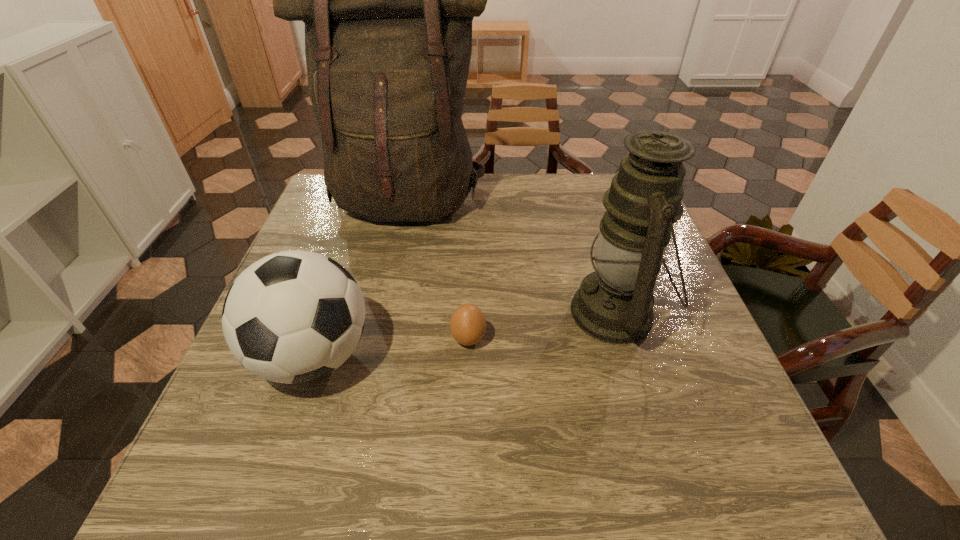
The height and width of the screenshot is (540, 960). What are the coordinates of `free space between the soccer ball and the tallest object` in the screenshot? It's located at (360, 279).

Locate an element on the screen. The height and width of the screenshot is (540, 960). vacant space that is in between the tallest object and the soccer ball is located at coordinates (x=360, y=279).

Where is `empty space that is in between the soccer ball and the backpack`? The image size is (960, 540). empty space that is in between the soccer ball and the backpack is located at coordinates (360, 279).

Locate an element on the screen. The width and height of the screenshot is (960, 540). empty location between the oil lamp and the backpack is located at coordinates (511, 258).

Where is `vacant space that is in between the soccer ball and the boiled egg`? The image size is (960, 540). vacant space that is in between the soccer ball and the boiled egg is located at coordinates (391, 348).

This screenshot has height=540, width=960. Identify the location of free point between the second tallest object and the farthest object. (511, 258).

You are a GUI agent. You are given a task and a screenshot of the screen. Output one action in this format:
    pyautogui.click(x=<x>, y=<y>)
    Task: Click on the free spot between the boiled egg and the soccer ball
    Image resolution: width=960 pixels, height=540 pixels.
    Given the screenshot: What is the action you would take?
    pyautogui.click(x=391, y=348)

Locate an element on the screen. vacant point located between the boiled egg and the soccer ball is located at coordinates (391, 348).

Where is `vacant region between the boiled egg and the backpack`? vacant region between the boiled egg and the backpack is located at coordinates (438, 271).

This screenshot has width=960, height=540. Find the location of `free spot between the boiled egg and the backpack`. free spot between the boiled egg and the backpack is located at coordinates (438, 271).